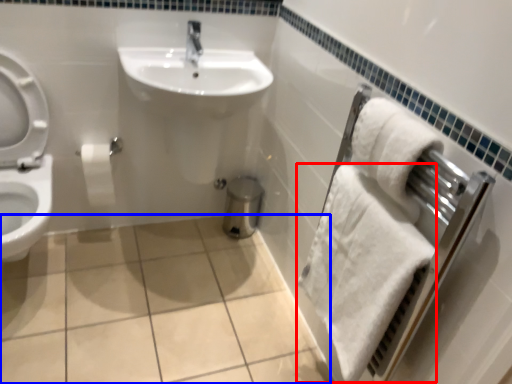
Question: Which point is closer to the camera, bath towel (highlighted by a red box) or ceramic tile (highlighted by a blue box)?

Choices:
 (A) bath towel
 (B) ceramic tile

Answer: (A)